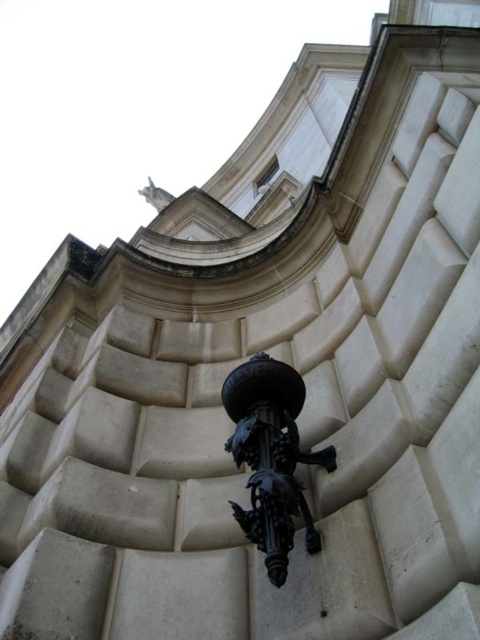
Question: Can you confirm if black wrought iron at center is positioned to the right of white stone statue at upper center?

Choices:
 (A) yes
 (B) no

Answer: (A)

Question: Observing the image, what is the correct spatial positioning of black wrought iron at center in reference to white stone statue at upper center?

Choices:
 (A) left
 (B) right

Answer: (B)

Question: Which object is farther from the camera taking this photo?

Choices:
 (A) black wrought iron at center
 (B) white stone statue at upper center

Answer: (B)

Question: Does black wrought iron at center appear over white stone statue at upper center?

Choices:
 (A) no
 (B) yes

Answer: (A)